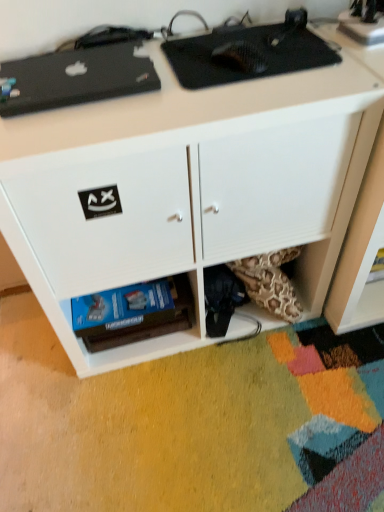
Locate an element on the screen. empty space that is ontop of black matte laptop at upper left, positioned as the 1th appliance in left-to-right order (from a real-world perspective) is located at coordinates (75, 68).